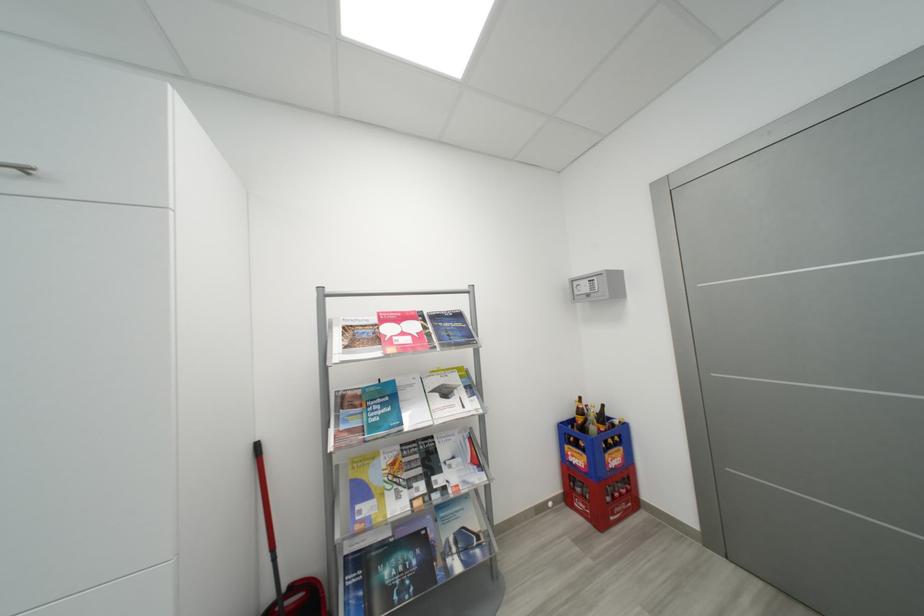
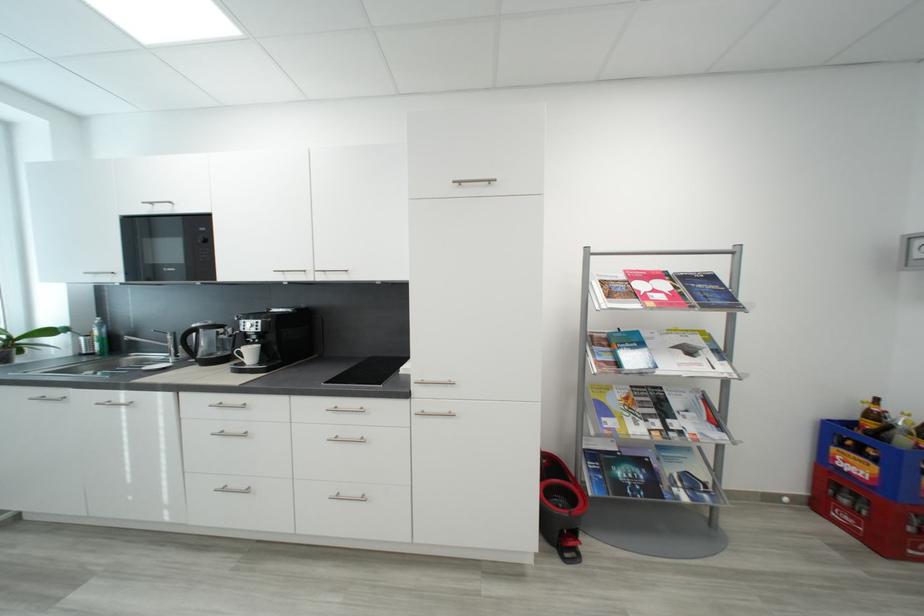
Locate, in the second image, the point that corresponds to [584,447] in the first image.

(867, 454)